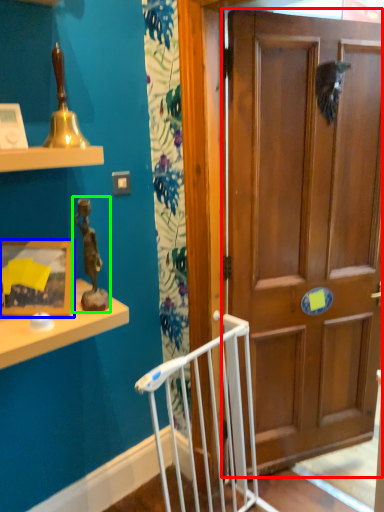
Question: Considering the real-world distances, which object is farthest from door (highlighted by a red box)? picture frame (highlighted by a blue box) or toy (highlighted by a green box)?

Choices:
 (A) picture frame
 (B) toy

Answer: (A)